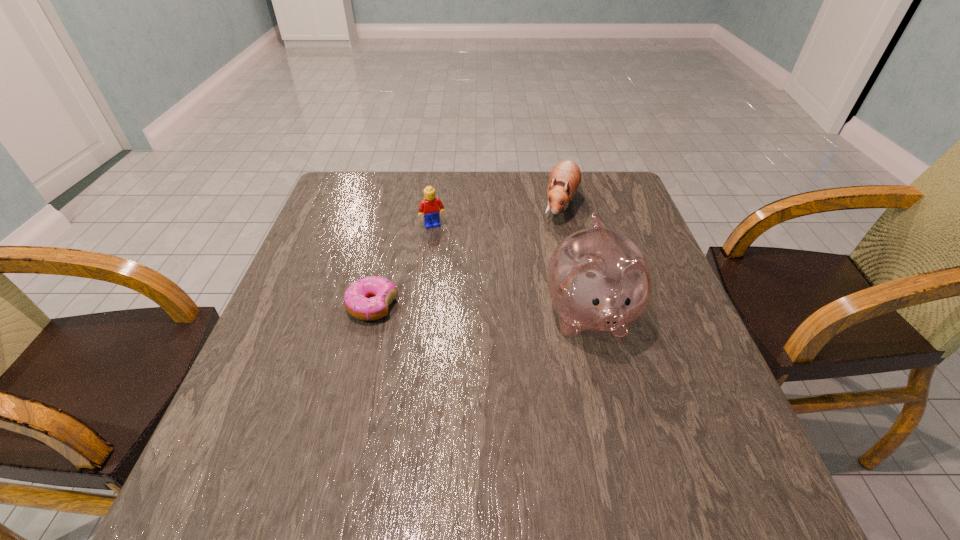
Locate an element on the screen. object identified as the closest to the third object from right to left is located at coordinates (368, 298).

At what (x,y) coordinates should I click in order to perform the action: click on object that is the third closest to the piggy bank. Please return your answer as a coordinate pair (x, y). The width and height of the screenshot is (960, 540). Looking at the image, I should click on (368, 298).